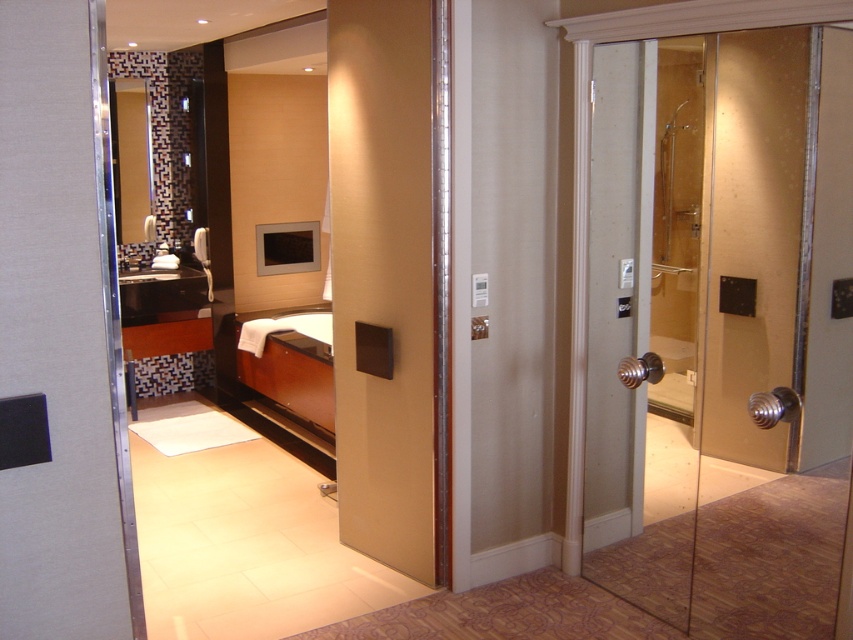
Question: Is transparent glass shower at right thinner than matte black panel at center?

Choices:
 (A) yes
 (B) no

Answer: (B)

Question: Which point is closer to the camera taking this photo?

Choices:
 (A) (421, 509)
 (B) (683, 52)

Answer: (B)

Question: Can you confirm if transparent glass shower at right is positioned below matte black panel at center?

Choices:
 (A) yes
 (B) no

Answer: (A)

Question: Which object is closer to the camera taking this photo?

Choices:
 (A) transparent glass shower at right
 (B) matte black panel at center

Answer: (A)

Question: Can you confirm if transparent glass shower at right is bigger than matte black panel at center?

Choices:
 (A) yes
 (B) no

Answer: (A)